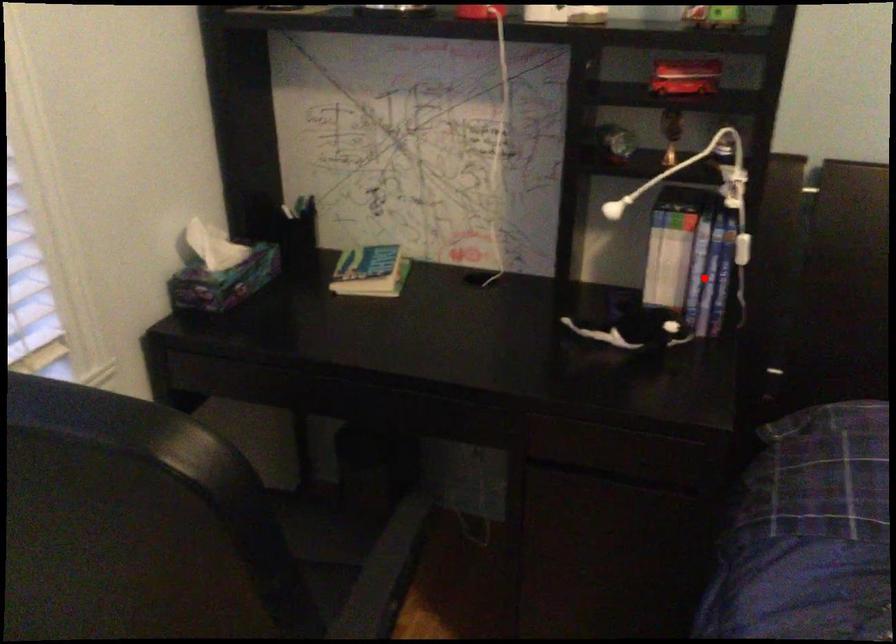
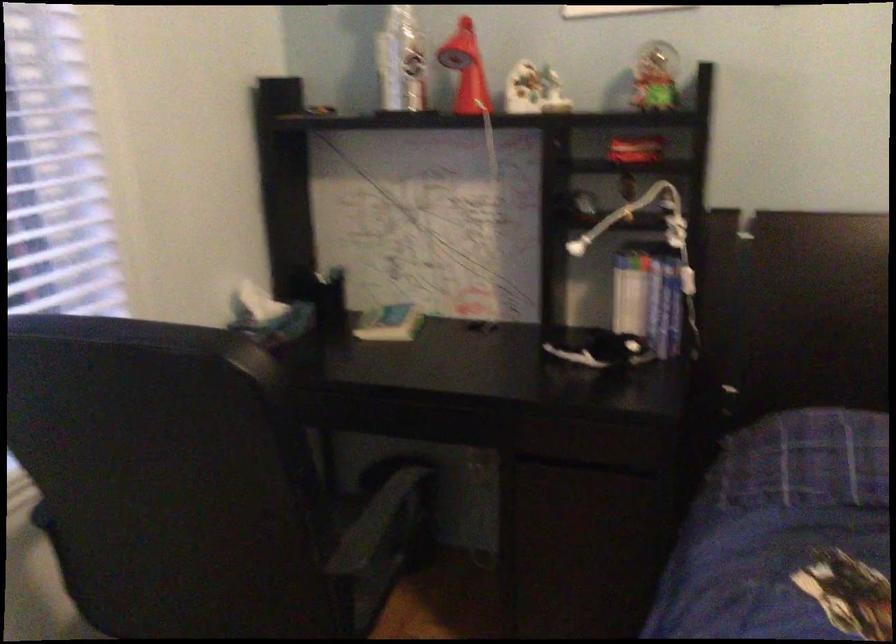
Question: I am providing you with two images of the same scene from different viewpoints. A red point is shown in image1. For the corresponding object point in image2, is it positioned nearer or farther from the camera?

Choices:
 (A) Nearer
 (B) Farther

Answer: (B)